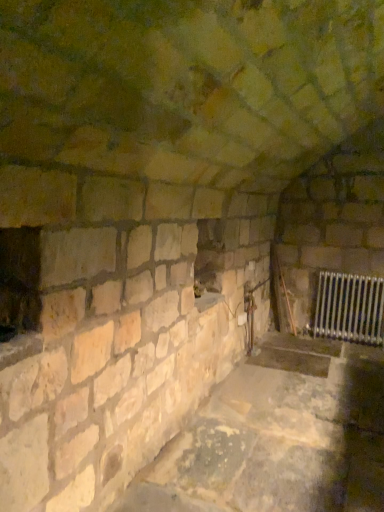
You are a GUI agent. You are given a task and a screenshot of the screen. Output one action in this format:
    pyautogui.click(x=<x>, y=<y>)
    Task: Click on the silver metallic radiator at right
    The image size is (384, 512).
    Given the screenshot: What is the action you would take?
    pyautogui.click(x=350, y=308)

Image resolution: width=384 pixels, height=512 pixels. Describe the element at coordinates (350, 308) in the screenshot. I see `silver metallic radiator at right` at that location.

The image size is (384, 512). I want to click on silver metallic radiator at right, so click(350, 308).